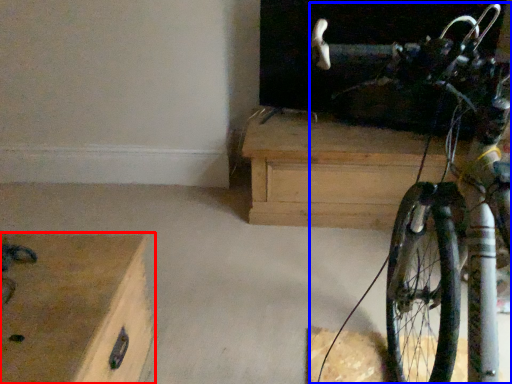
Question: Which point is closer to the camera, chest of drawers (highlighted by a red box) or bicycle (highlighted by a blue box)?

Choices:
 (A) chest of drawers
 (B) bicycle

Answer: (B)